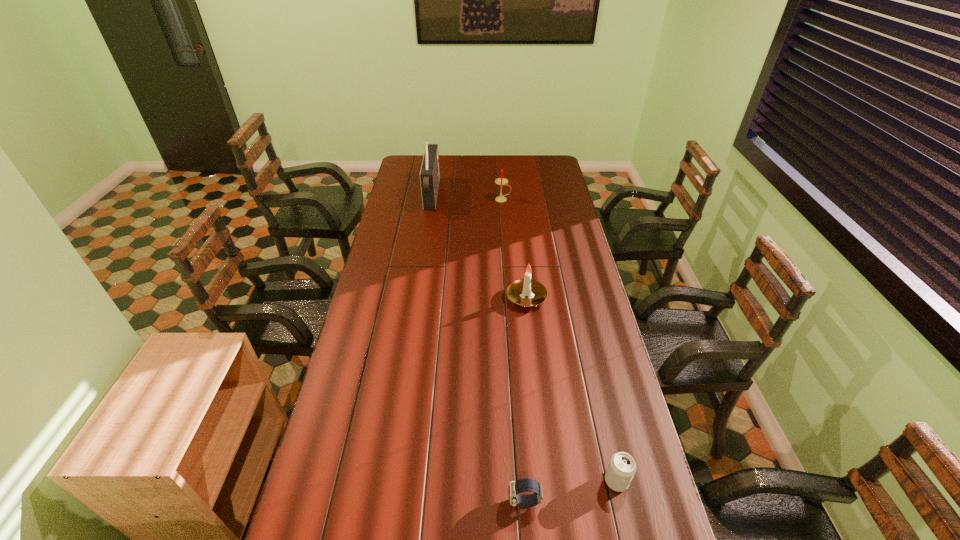
Find the location of a particular element. The height and width of the screenshot is (540, 960). radio receiver is located at coordinates (429, 174).

Where is `the tallest object`? Image resolution: width=960 pixels, height=540 pixels. the tallest object is located at coordinates (429, 174).

You are a GUI agent. You are given a task and a screenshot of the screen. Output one action in this format:
    pyautogui.click(x=<x>, y=<y>)
    Task: Click on the nearer candle
    
    Given the screenshot: What is the action you would take?
    pyautogui.click(x=516, y=291)

Where is `the farther candle`? The width and height of the screenshot is (960, 540). the farther candle is located at coordinates (501, 181).

Identify the location of can. The height and width of the screenshot is (540, 960). (622, 467).

This screenshot has height=540, width=960. I want to click on watch, so click(523, 485).

This screenshot has width=960, height=540. Find the location of `vacant region located on the front panel of the leftmost object`. vacant region located on the front panel of the leftmost object is located at coordinates (474, 195).

You are a GUI agent. You are given a task and a screenshot of the screen. Output one action in this format:
    pyautogui.click(x=<x>, y=<y>)
    Task: Click on the free space located on the front of the nearer candle
    
    Given the screenshot: What is the action you would take?
    pyautogui.click(x=530, y=330)

At what (x,y) coordinates should I click in order to perform the action: click on vacant space positioned 0.070m on the front of the farther candle. Please return your answer as a coordinate pair (x, y). This screenshot has width=960, height=540. Looking at the image, I should click on (503, 210).

Where is `vacant space located on the front of the rightmost object`? This screenshot has width=960, height=540. vacant space located on the front of the rightmost object is located at coordinates (624, 513).